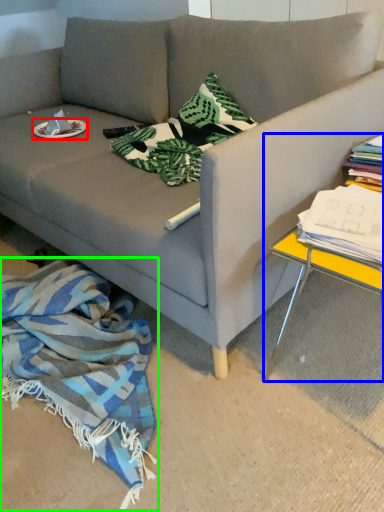
Question: Considering the real-world distances, which object is farthest from plate (highlighted by a red box)? table (highlighted by a blue box) or blanket (highlighted by a green box)?

Choices:
 (A) table
 (B) blanket

Answer: (A)